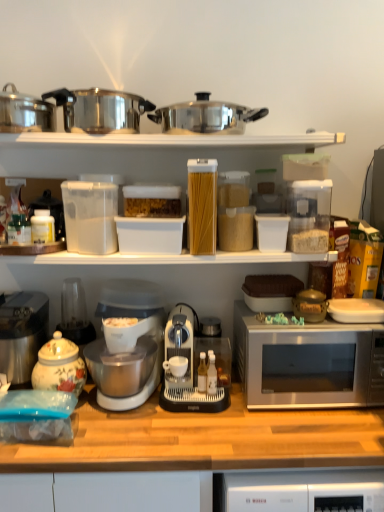
Locate an element on the screen. vacant area that lies to the right of porcelain floral tea pot at left is located at coordinates (109, 418).